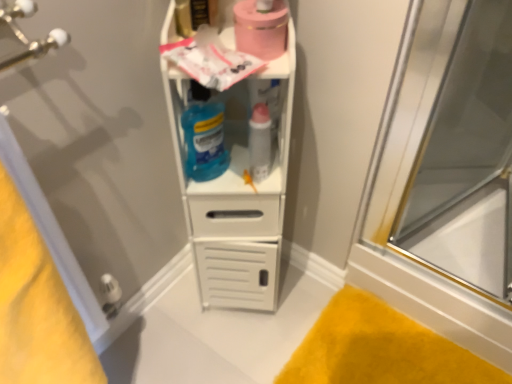
Where is `transparent glass screen door at left`? transparent glass screen door at left is located at coordinates (98, 155).

Where is `yellow plush bath mat at lower right`? This screenshot has height=384, width=512. yellow plush bath mat at lower right is located at coordinates (379, 348).

This screenshot has width=512, height=384. I want to click on transparent glass door at right, so point(467,161).

What do you see at coordinates (467, 161) in the screenshot?
I see `transparent glass door at right` at bounding box center [467, 161].

You are a GUI agent. You are given a task and a screenshot of the screen. Output one action in this format:
    pyautogui.click(x=<x>, y=<y>)
    Task: Click on the translucent blue liquid at center
    The height and width of the screenshot is (384, 512).
    Given the screenshot: What is the action you would take?
    pyautogui.click(x=204, y=136)

Find the location of a particular element. yellow fabric towel at lower left is located at coordinates (37, 306).

From the image's perspective, is yellow fabric towel at lower left above or below pink matte toilet paper at upper center?

From the image's perspective, yellow fabric towel at lower left appears below pink matte toilet paper at upper center.

Do you think yellow fabric towel at lower left is within pink matte toilet paper at upper center, or outside of it?

The correct answer is: outside.

Is yellow fabric towel at lower left facing towards pink matte toilet paper at upper center?

No, yellow fabric towel at lower left does not turn towards pink matte toilet paper at upper center.

Image resolution: width=512 pixels, height=384 pixels. What are the coordinates of `glass door in front of the pink matte toilet paper at upper center` in the screenshot? It's located at (467, 161).

Considering the sizes of transparent glass door at right and pink matte toilet paper at upper center in the image, is transparent glass door at right taller or shorter than pink matte toilet paper at upper center?

Clearly, transparent glass door at right is taller compared to pink matte toilet paper at upper center.

Are transparent glass door at right and pink matte toilet paper at upper center far apart?

Actually, transparent glass door at right and pink matte toilet paper at upper center are a little close together.

How many degrees apart are the facing directions of transparent glass door at right and pink matte toilet paper at upper center?

The angular difference between transparent glass door at right and pink matte toilet paper at upper center is 56.9 degrees.

The height and width of the screenshot is (384, 512). I want to click on bath mat that appears behind the white plastic shelf at center, so click(379, 348).

Based on the photo, can we say yellow plush bath mat at lower right lies outside white plastic shelf at center?

Yes, yellow plush bath mat at lower right is not within white plastic shelf at center.

In the scene shown: Relative to white plastic shelf at center, is yellow plush bath mat at lower right in front or behind?

Visually, yellow plush bath mat at lower right is located behind white plastic shelf at center.

What are the coordinates of `beach towel below the matte plastic lipstick at center (from the image's perspective)` in the screenshot? It's located at (37, 306).

Can you confirm if matte plastic lipstick at center is taller than yellow fabric towel at lower left?

In fact, matte plastic lipstick at center may be shorter than yellow fabric towel at lower left.

From a real-world perspective, who is located higher, matte plastic lipstick at center or yellow fabric towel at lower left?

matte plastic lipstick at center.

Considering the relative sizes of matte plastic lipstick at center and yellow fabric towel at lower left in the image provided, is matte plastic lipstick at center smaller than yellow fabric towel at lower left?

Correct, matte plastic lipstick at center occupies less space than yellow fabric towel at lower left.

From their relative heights in the image, would you say yellow fabric towel at lower left is taller or shorter than white plastic shelf at center?

Considering their sizes, yellow fabric towel at lower left has less height than white plastic shelf at center.

Is yellow fabric towel at lower left facing towards white plastic shelf at center?

No, yellow fabric towel at lower left does not turn towards white plastic shelf at center.

Which is correct: yellow fabric towel at lower left is inside white plastic shelf at center, or outside of it?

yellow fabric towel at lower left cannot be found inside white plastic shelf at center.

What's the angular difference between yellow fabric towel at lower left and transparent glass door at right's facing directions?

They differ by 110 degrees in their facing directions.

Is yellow fabric towel at lower left not near transparent glass door at right?

yellow fabric towel at lower left is far away from transparent glass door at right.

From a real-world perspective, which object stands above the other?

In real-world perspective, transparent glass door at right is above.

Can you confirm if yellow fabric towel at lower left is wider than transparent glass door at right?

In fact, yellow fabric towel at lower left might be narrower than transparent glass door at right.

Is yellow plush bath mat at lower right inside or outside of transparent glass door at right?

The correct answer is: outside.

At what (x,y) coordinates should I click in order to perform the action: click on glass door that is in front of the yellow plush bath mat at lower right. Please return your answer as a coordinate pair (x, y). The height and width of the screenshot is (384, 512). Looking at the image, I should click on (467, 161).

Does yellow plush bath mat at lower right have a lesser height compared to transparent glass door at right?

Correct, yellow plush bath mat at lower right is not as tall as transparent glass door at right.

From the image's perspective, who appears lower, yellow plush bath mat at lower right or transparent glass door at right?

yellow plush bath mat at lower right appears lower in the image.

Identify the location of beach towel on the left of pink matte toilet paper at upper center. The image size is (512, 384). (37, 306).

Identify the location of glass door below the pink matte toilet paper at upper center (from the image's perspective). (467, 161).

Based on their spatial positions, is pink matte toilet paper at upper center or yellow plush bath mat at lower right further from white plastic shelf at center?

Among the two, yellow plush bath mat at lower right is located further to white plastic shelf at center.

From the image, which object appears to be nearer to transparent glass door at right, yellow plush bath mat at lower right or matte plastic lipstick at center?

Based on the image, yellow plush bath mat at lower right appears to be nearer to transparent glass door at right.

Based on the photo, when comparing their distances from transparent glass screen door at left, does white plastic shelf at center or translucent blue liquid at center seem closer?

white plastic shelf at center.

Which object lies nearer to the anchor point white plastic shelf at center, transparent glass door at right or transparent glass screen door at left?

transparent glass screen door at left is positioned closer to the anchor white plastic shelf at center.

Based on their spatial positions, is matte plastic lipstick at center or transparent glass door at right further from transparent glass screen door at left?

transparent glass door at right is positioned further to the anchor transparent glass screen door at left.

From the image, which object appears to be nearer to yellow fabric towel at lower left, matte plastic lipstick at center or yellow plush bath mat at lower right?

matte plastic lipstick at center is positioned closer to the anchor yellow fabric towel at lower left.

Based on their spatial positions, is white plastic shelf at center or transparent glass door at right closer to transparent glass screen door at left?

white plastic shelf at center lies closer to transparent glass screen door at left than the other object.

Looking at this image, estimate the real-world distances between objects in this image. Which object is further from matte plastic lipstick at center, transparent glass screen door at left or transparent glass door at right?

Based on the image, transparent glass door at right appears to be further to matte plastic lipstick at center.

The image size is (512, 384). I want to click on screen door between yellow fabric towel at lower left and yellow plush bath mat at lower right in the horizontal direction, so click(98, 155).

The width and height of the screenshot is (512, 384). I want to click on shelf between yellow fabric towel at lower left and matte plastic lipstick at center in the front-back direction, so click(x=238, y=188).

You are a GUI agent. You are given a task and a screenshot of the screen. Output one action in this format:
    pyautogui.click(x=<x>, y=<y>)
    Task: Click on the cleaning product between yellow fabric towel at lower left and yellow plush bath mat at lower right in the horizontal direction
    
    Given the screenshot: What is the action you would take?
    pyautogui.click(x=204, y=136)

Where is `cleaning product between transparent glass screen door at left and transparent glass door at right`? cleaning product between transparent glass screen door at left and transparent glass door at right is located at coordinates (204, 136).